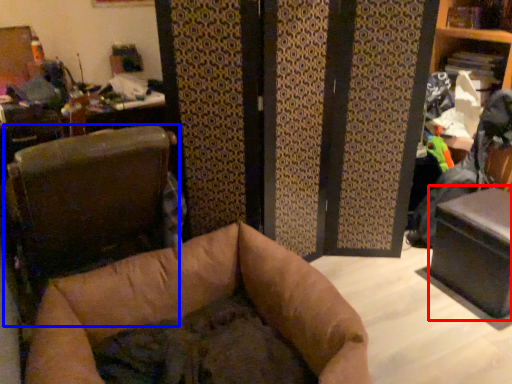
Question: Which of the following is the closest to the observer, table (highlighted by a red box) or furniture (highlighted by a blue box)?

Choices:
 (A) table
 (B) furniture

Answer: (B)